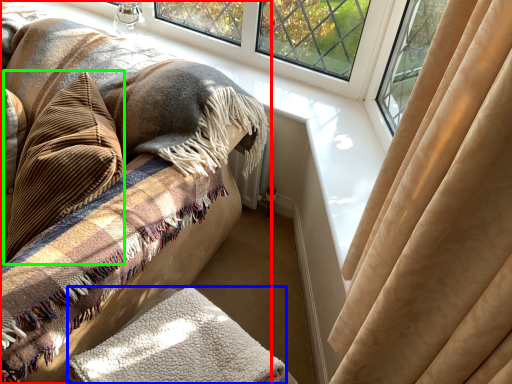
Question: Estimate the real-world distances between objects in this image. Which object is farther from furniture (highlighted by a red box), blanket (highlighted by a blue box) or throw pillow (highlighted by a green box)?

Choices:
 (A) blanket
 (B) throw pillow

Answer: (A)